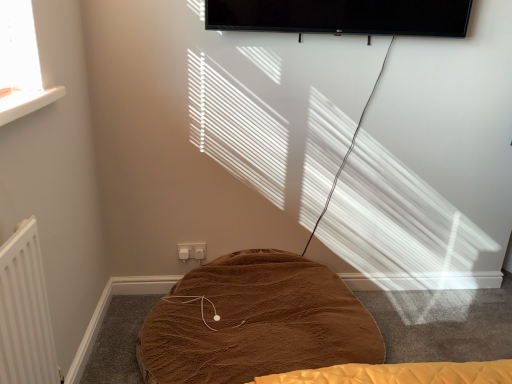
Question: In which direction should I rotate to look at white plastic electric outlet at lower center?

Choices:
 (A) left
 (B) right

Answer: (A)

Question: Is brown plush blanket at center not within white plastic electric outlet at lower center?

Choices:
 (A) yes
 (B) no

Answer: (A)

Question: Is brown plush blanket at center in contact with white plastic electric outlet at lower center?

Choices:
 (A) yes
 (B) no

Answer: (B)

Question: Is brown plush blanket at center facing towards white plastic electric outlet at lower center?

Choices:
 (A) yes
 (B) no

Answer: (B)

Question: Considering the relative sizes of brown plush blanket at center and white plastic electric outlet at lower center in the image provided, is brown plush blanket at center wider than white plastic electric outlet at lower center?

Choices:
 (A) yes
 (B) no

Answer: (A)

Question: Is brown plush blanket at center bigger than white plastic electric outlet at lower center?

Choices:
 (A) yes
 (B) no

Answer: (A)

Question: Does brown plush blanket at center have a greater height compared to white plastic electric outlet at lower center?

Choices:
 (A) no
 (B) yes

Answer: (B)

Question: Does white plastic electric outlet at lower center come in front of brown plush blanket at center?

Choices:
 (A) yes
 (B) no

Answer: (B)

Question: From a real-world perspective, is white plastic electric outlet at lower center positioned over brown plush blanket at center based on gravity?

Choices:
 (A) no
 (B) yes

Answer: (B)

Question: Is white plastic electric outlet at lower center looking in the opposite direction of brown plush blanket at center?

Choices:
 (A) no
 (B) yes

Answer: (A)

Question: From a real-world perspective, is white plastic electric outlet at lower center positioned under brown plush blanket at center based on gravity?

Choices:
 (A) yes
 (B) no

Answer: (B)

Question: Does white plastic electric outlet at lower center have a larger size compared to brown plush blanket at center?

Choices:
 (A) no
 (B) yes

Answer: (A)

Question: Can you confirm if white plastic electric outlet at lower center is positioned to the left of brown plush blanket at center?

Choices:
 (A) no
 (B) yes

Answer: (B)

Question: Choose the correct answer: Is brown plush blanket at center inside white plastic electric outlet at lower center or outside it?

Choices:
 (A) inside
 (B) outside

Answer: (B)